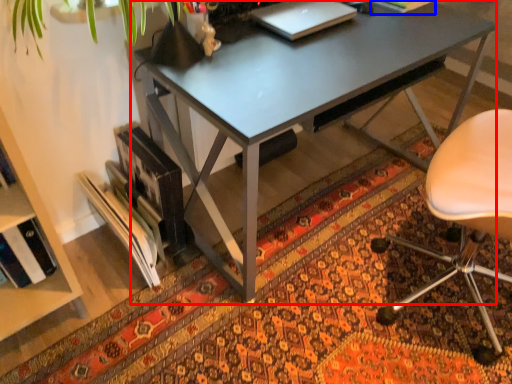
Question: Which object appears farthest to the camera in this image, desk (highlighted by a red box) or book (highlighted by a blue box)?

Choices:
 (A) desk
 (B) book

Answer: (B)